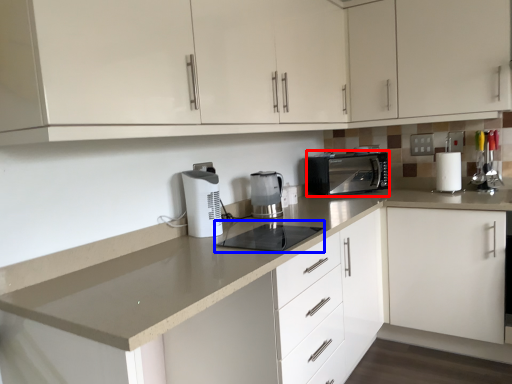
Question: Which object is further to the camera taking this photo, kitchen appliance (highlighted by a red box) or appliance (highlighted by a blue box)?

Choices:
 (A) kitchen appliance
 (B) appliance

Answer: (A)